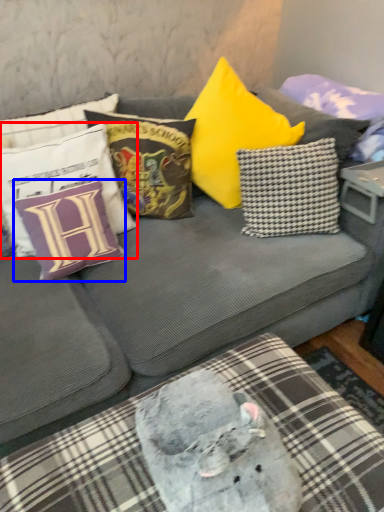
Question: Which object appears closest to the camera in this image, pillow (highlighted by a red box) or pillow (highlighted by a blue box)?

Choices:
 (A) pillow
 (B) pillow

Answer: (A)